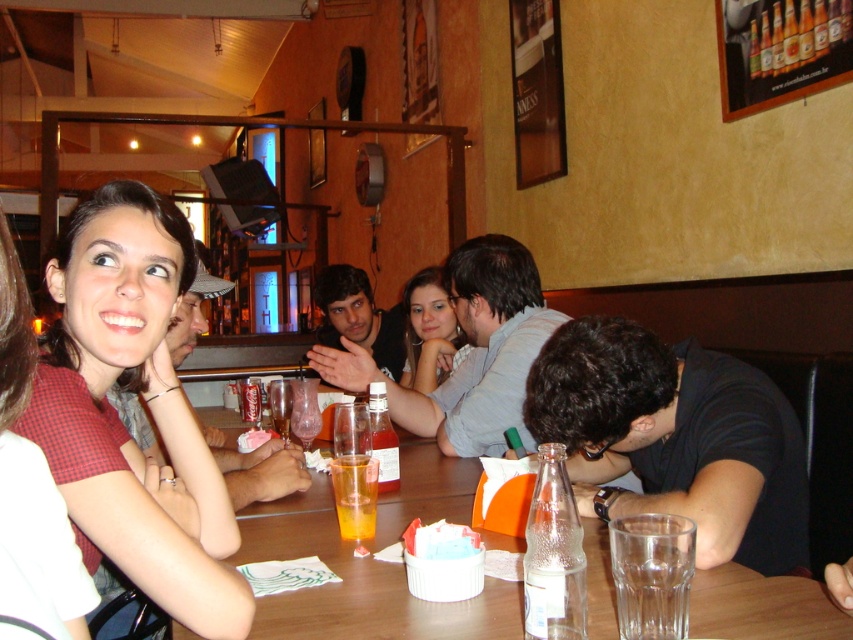
Question: Does wooden table at center lie in front of translucent glass at table center?

Choices:
 (A) no
 (B) yes

Answer: (B)

Question: Among these points, which one is farthest from the camera?

Choices:
 (A) (654, 342)
 (B) (136, 353)
 (C) (349, 536)

Answer: (A)

Question: Which of the following is the closest to the observer?

Choices:
 (A) matte black shirt at center
 (B) matte red shirt at center
 (C) matte gray shirt at upper center
 (D) black matte shirt at lower right

Answer: (B)

Question: Does wooden table at center have a smaller size compared to translucent glass at table center?

Choices:
 (A) no
 (B) yes

Answer: (A)

Question: Is black matte shirt at lower right further to the viewer compared to matte gray shirt at upper center?

Choices:
 (A) no
 (B) yes

Answer: (A)

Question: Which point is closer to the camera?

Choices:
 (A) matte red shirt at center
 (B) red checkered shirt at upper left
 (C) translucent glass at table center

Answer: (B)